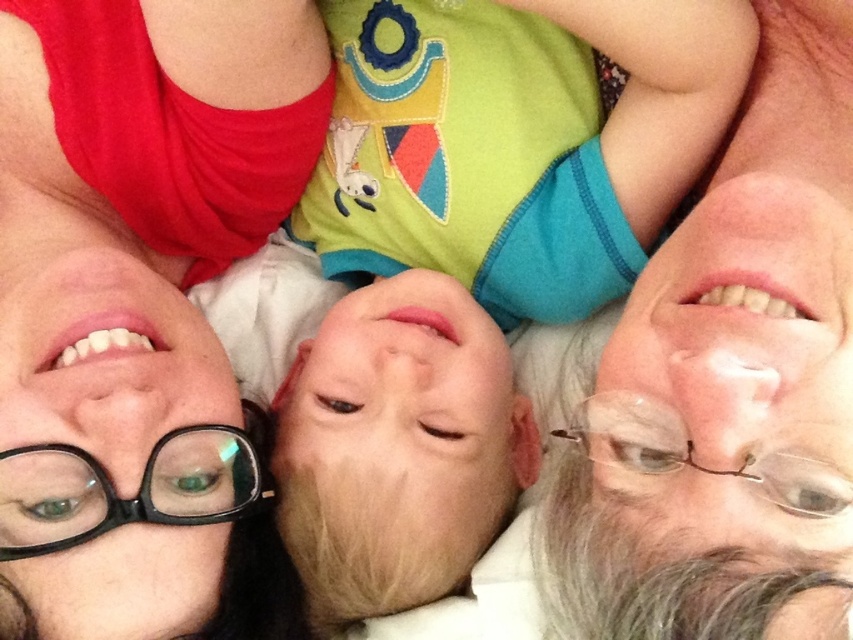
Who is higher up, green fabric baby at center or matte black glasses at upper left?

green fabric baby at center is higher up.

Which is behind, point (579, 10) or point (15, 442)?

Point (579, 10)

Is point (422, 58) positioned after point (300, 65)?

Yes, point (422, 58) is farther from viewer.

Where is `green fabric baby at center`? The width and height of the screenshot is (853, 640). green fabric baby at center is located at coordinates (456, 266).

Is point (415, 368) farther from camera compared to point (814, 100)?

Yes, it is.

Who is more forward, (422, 156) or (838, 412)?

Point (838, 412)

The image size is (853, 640). In order to click on green fabric baby at center in this screenshot , I will do `click(456, 266)`.

Between matte black glasses at upper left and gray hair at right, which one has less height?

gray hair at right is shorter.

Does matte black glasses at upper left appear on the right side of gray hair at right?

No, matte black glasses at upper left is not to the right of gray hair at right.

Where is `matte black glasses at upper left`? The height and width of the screenshot is (640, 853). matte black glasses at upper left is located at coordinates (138, 289).